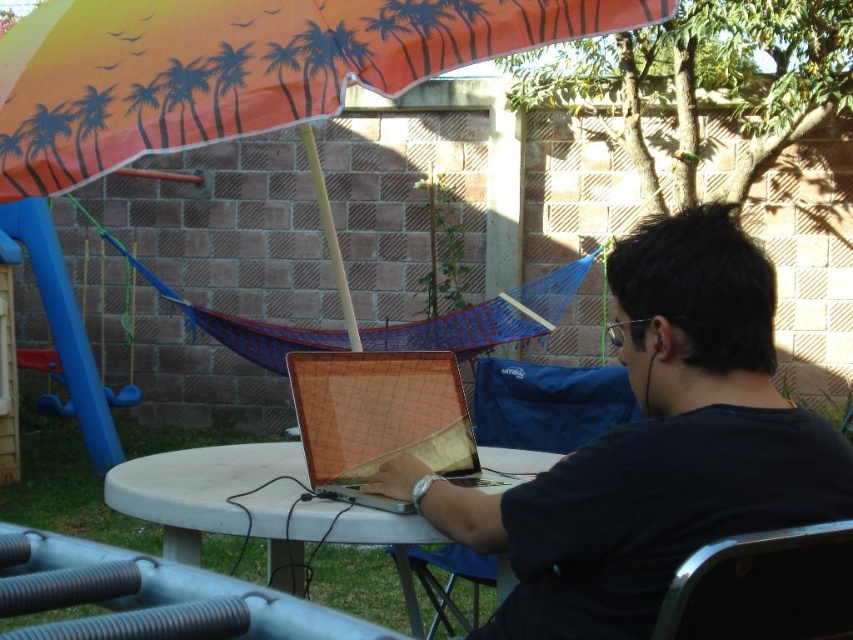
Question: Is black matte shirt at center above metallic silver laptop at center?

Choices:
 (A) no
 (B) yes

Answer: (A)

Question: Is black matte shirt at center bigger than orange fabric umbrella at upper center?

Choices:
 (A) no
 (B) yes

Answer: (A)

Question: Which of the following is the farthest from the observer?

Choices:
 (A) metallic silver laptop at center
 (B) metallic silver chair at lower right

Answer: (A)

Question: Where is metallic silver laptop at center located in relation to metallic silver chair at lower right in the image?

Choices:
 (A) below
 (B) above

Answer: (B)

Question: Which of the following is the closest to the observer?

Choices:
 (A) white plastic table at center
 (B) metallic silver chair at lower right

Answer: (B)

Question: Among these objects, which one is nearest to the camera?

Choices:
 (A) black matte shirt at center
 (B) orange fabric umbrella at upper center
 (C) metallic silver chair at lower right

Answer: (C)